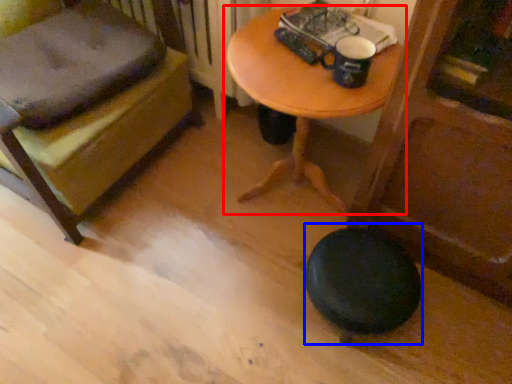
Question: Which object is closer to the camera taking this photo, table (highlighted by a red box) or stool (highlighted by a blue box)?

Choices:
 (A) table
 (B) stool

Answer: (A)